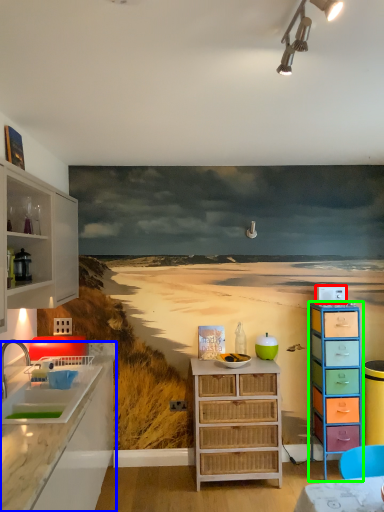
Question: Which object is positioned farthest from appliance (highlighted by a red box)? Select from countertop (highlighted by a blue box) and chest of drawers (highlighted by a green box).

Choices:
 (A) countertop
 (B) chest of drawers

Answer: (A)